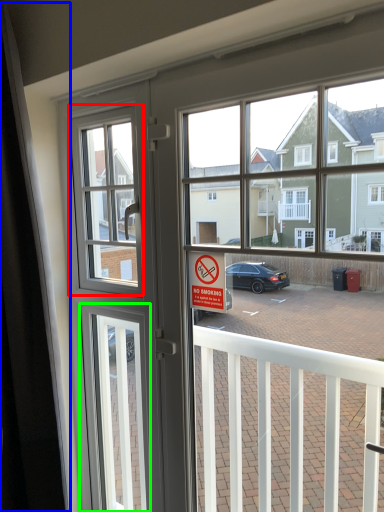
Question: Considering the real-world distances, which object is farthest from window screen (highlighted by a red box)? curtain (highlighted by a blue box) or screen door (highlighted by a green box)?

Choices:
 (A) curtain
 (B) screen door

Answer: (B)